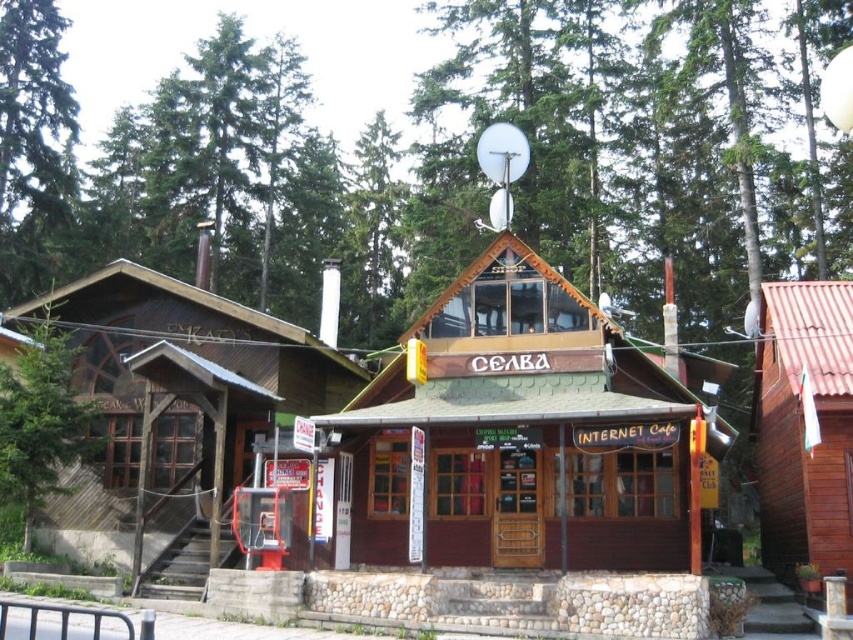
Can you confirm if wooden cabin at center is positioned above green textured tree at left?

Indeed, wooden cabin at center is positioned over green textured tree at left.

Can you confirm if wooden cabin at center is smaller than green textured tree at left?

No.

Which is behind, point (288, 378) or point (16, 392)?

Point (288, 378)

Where is `wooden cabin at center`? wooden cabin at center is located at coordinates (178, 392).

Which is more to the left, brown wooden cabin at center or wooden cabin at right?

Positioned to the left is brown wooden cabin at center.

Does brown wooden cabin at center lie in front of wooden cabin at right?

Yes, it is in front of wooden cabin at right.

Who is more distant from viewer, (457, 381) or (839, 532)?

The point (457, 381) is behind.

This screenshot has height=640, width=853. I want to click on brown wooden cabin at center, so click(521, 433).

Can you confirm if brown wooden cabin at center is positioned to the left of green textured tree at left?

No, brown wooden cabin at center is not to the left of green textured tree at left.

Who is more distant from viewer, (570, 323) or (35, 486)?

The point (35, 486) is more distant.

Is point (500, 544) positioned after point (99, 413)?

No.

Locate an element on the screen. brown wooden cabin at center is located at coordinates (521, 433).